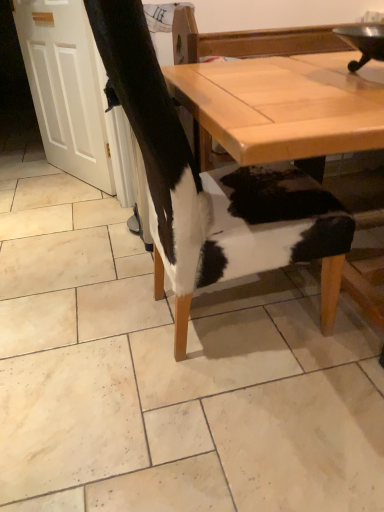
Question: Considering the positions of point (311, 378) and point (276, 140), is point (311, 378) closer or farther from the camera than point (276, 140)?

Choices:
 (A) farther
 (B) closer

Answer: (A)

Question: From a real-world perspective, is cowhide chair at center positioned above or below light brown wooden table at center?

Choices:
 (A) above
 (B) below

Answer: (B)

Question: Which object is positioned closest to the light brown wooden table at center?

Choices:
 (A) cowhide at center
 (B) cowhide chair at center
 (C) cowhide chair at center

Answer: (C)

Question: Based on their relative distances, which object is nearer to the light brown wooden table at center?

Choices:
 (A) cowhide chair at center
 (B) cowhide chair at center
 (C) cowhide at center

Answer: (A)